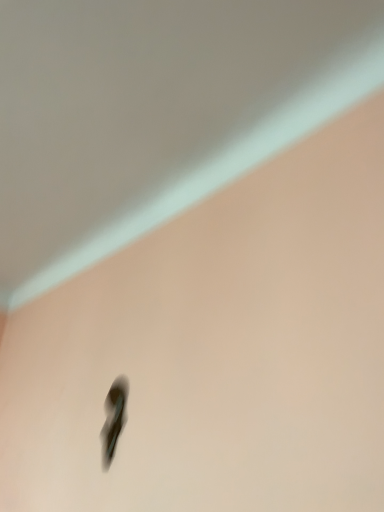
Question: Does matte black shoe at lower left have a larger size compared to matte white ceiling at upper center?

Choices:
 (A) no
 (B) yes

Answer: (A)

Question: Are matte black shoe at lower left and matte white ceiling at upper center beside each other?

Choices:
 (A) yes
 (B) no

Answer: (B)

Question: Are matte black shoe at lower left and matte white ceiling at upper center far apart?

Choices:
 (A) yes
 (B) no

Answer: (B)

Question: From a real-world perspective, is matte black shoe at lower left physically above matte white ceiling at upper center?

Choices:
 (A) yes
 (B) no

Answer: (B)

Question: Considering the relative sizes of matte black shoe at lower left and matte white ceiling at upper center in the image provided, is matte black shoe at lower left smaller than matte white ceiling at upper center?

Choices:
 (A) yes
 (B) no

Answer: (A)

Question: Is matte black shoe at lower left at the right side of matte white ceiling at upper center?

Choices:
 (A) no
 (B) yes

Answer: (B)

Question: From a real-world perspective, is matte white ceiling at upper center on matte black shoe at lower left?

Choices:
 (A) yes
 (B) no

Answer: (A)

Question: Could you tell me if matte white ceiling at upper center is turned towards matte black shoe at lower left?

Choices:
 (A) no
 (B) yes

Answer: (A)

Question: From a real-world perspective, is matte white ceiling at upper center located beneath matte black shoe at lower left?

Choices:
 (A) yes
 (B) no

Answer: (B)

Question: Is matte white ceiling at upper center positioned beyond the bounds of matte black shoe at lower left?

Choices:
 (A) no
 (B) yes

Answer: (B)

Question: Can you confirm if matte white ceiling at upper center is shorter than matte black shoe at lower left?

Choices:
 (A) no
 (B) yes

Answer: (B)

Question: From the image's perspective, does matte white ceiling at upper center appear higher than matte black shoe at lower left?

Choices:
 (A) no
 (B) yes

Answer: (B)

Question: Looking at their shapes, would you say matte white ceiling at upper center is wider or thinner than matte black shoe at lower left?

Choices:
 (A) wide
 (B) thin

Answer: (A)